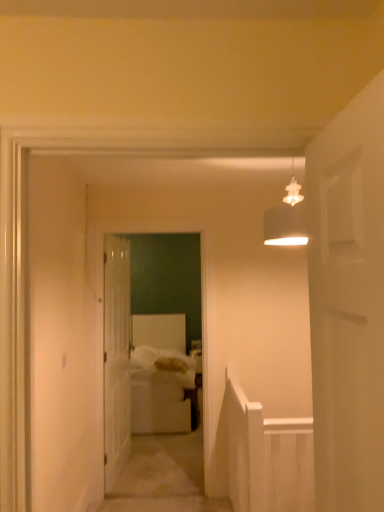
Locate an element on the screen. This screenshot has height=512, width=384. vacant space underneath white glossy door at center (from a real-world perspective) is located at coordinates (121, 466).